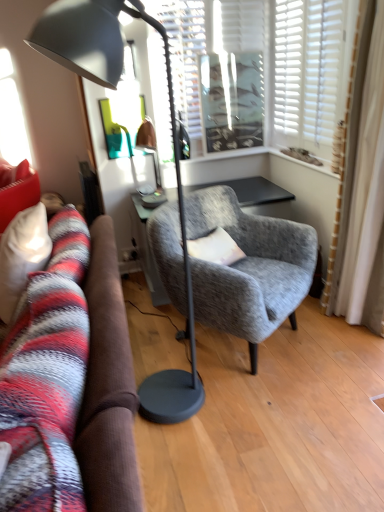
Question: Can you confirm if soft gray fabric pillow at center is positioned to the right of white textured blinds at upper center?

Choices:
 (A) yes
 (B) no

Answer: (B)

Question: From a real-world perspective, does soft gray fabric pillow at center sit lower than white textured blinds at upper center?

Choices:
 (A) yes
 (B) no

Answer: (A)

Question: From the image's perspective, would you say soft gray fabric pillow at center is shown under white textured blinds at upper center?

Choices:
 (A) no
 (B) yes

Answer: (B)

Question: Is the depth of soft gray fabric pillow at center less than that of white textured blinds at upper center?

Choices:
 (A) yes
 (B) no

Answer: (A)

Question: Considering the relative sizes of soft gray fabric pillow at center and white textured blinds at upper center in the image provided, is soft gray fabric pillow at center smaller than white textured blinds at upper center?

Choices:
 (A) no
 (B) yes

Answer: (B)

Question: From the image's perspective, is matte black floor lamp at left above or below textured gray armchair at center?

Choices:
 (A) above
 (B) below

Answer: (A)

Question: Is matte black floor lamp at left in front of or behind textured gray armchair at center in the image?

Choices:
 (A) behind
 (B) front

Answer: (B)

Question: Considering the positions of matte black floor lamp at left and textured gray armchair at center in the image, is matte black floor lamp at left bigger or smaller than textured gray armchair at center?

Choices:
 (A) big
 (B) small

Answer: (B)

Question: Is point (183, 407) positioned closer to the camera than point (175, 231)?

Choices:
 (A) closer
 (B) farther

Answer: (A)

Question: Is white textured blinds at upper center situated inside textured gray armchair at center or outside?

Choices:
 (A) outside
 (B) inside

Answer: (A)

Question: Considering their positions, is white textured blinds at upper center located in front of or behind textured gray armchair at center?

Choices:
 (A) front
 (B) behind

Answer: (B)

Question: Visually, is white textured blinds at upper center positioned to the left or to the right of textured gray armchair at center?

Choices:
 (A) right
 (B) left

Answer: (B)

Question: Does point (344, 14) appear closer or farther from the camera than point (211, 229)?

Choices:
 (A) farther
 (B) closer

Answer: (B)

Question: Would you say textured gray armchair at center is inside or outside matte black floor lamp at left?

Choices:
 (A) inside
 (B) outside

Answer: (B)

Question: Is point (170, 244) positioned closer to the camera than point (61, 36)?

Choices:
 (A) farther
 (B) closer

Answer: (A)